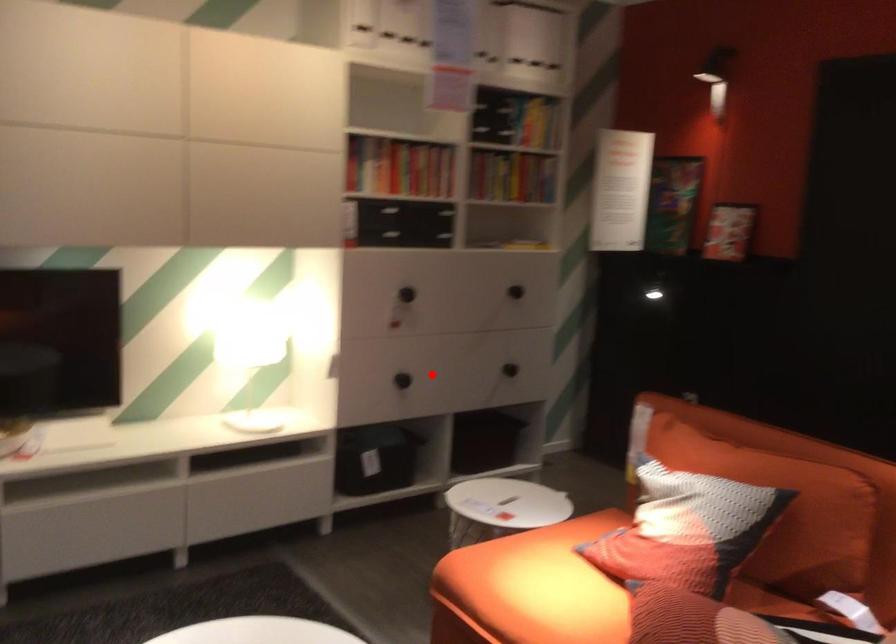
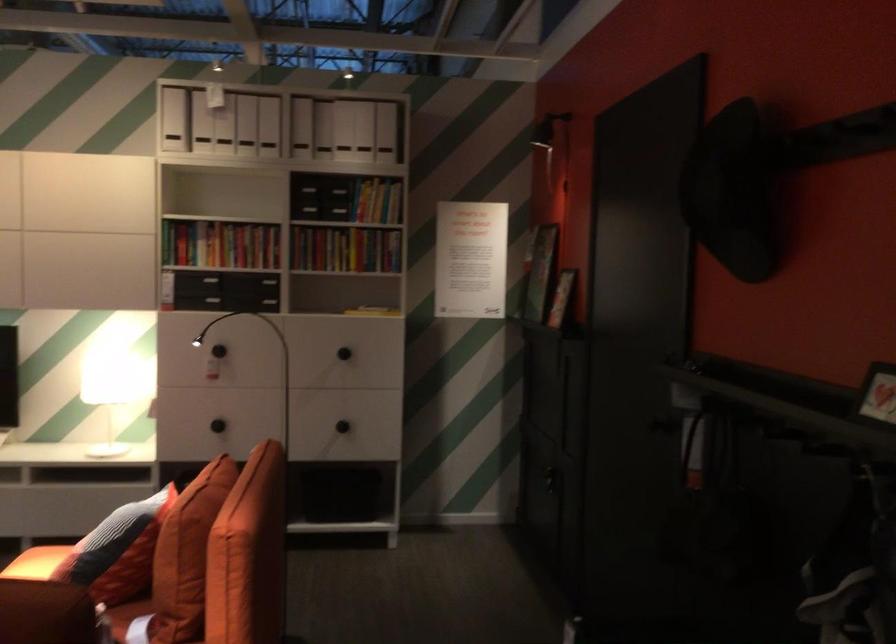
Question: A red point is marked in image1. In image2, is the corresponding 3D point closer to the camera or farther? Reply with the corresponding letter.

Choices:
 (A) The corresponding 3D point is closer.
 (B) The corresponding 3D point is farther.

Answer: (B)